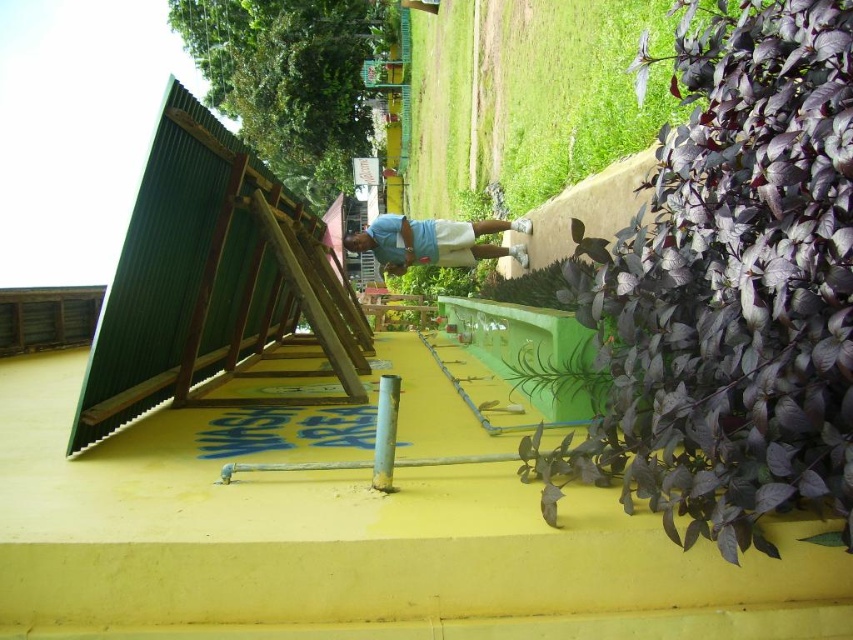
Can you confirm if light blue fabric at center is wider than purple leafy plant at center?

Yes.

Does point (416, 246) come closer to viewer compared to point (577, 262)?

No.

This screenshot has height=640, width=853. What are the coordinates of `light blue fabric at center` in the screenshot? It's located at (433, 241).

Can you confirm if purple matte leaves at upper right is positioned above green leafy plant at center?

Correct, purple matte leaves at upper right is located above green leafy plant at center.

Which is behind, point (666, 496) or point (581, 417)?

Positioned behind is point (581, 417).

Where is `purple matte leaves at upper right`? The image size is (853, 640). purple matte leaves at upper right is located at coordinates (730, 289).

Find the location of a particular element. This screenshot has width=853, height=640. purple matte leaves at upper right is located at coordinates (730, 289).

Does purple matte leaves at upper right come behind light blue fabric at center?

No, purple matte leaves at upper right is closer to the viewer.

Which of these two, purple matte leaves at upper right or light blue fabric at center, stands taller?

Standing taller between the two is purple matte leaves at upper right.

The width and height of the screenshot is (853, 640). Find the location of `purple matte leaves at upper right`. purple matte leaves at upper right is located at coordinates (730, 289).

The width and height of the screenshot is (853, 640). Find the location of `purple matte leaves at upper right`. purple matte leaves at upper right is located at coordinates (730, 289).